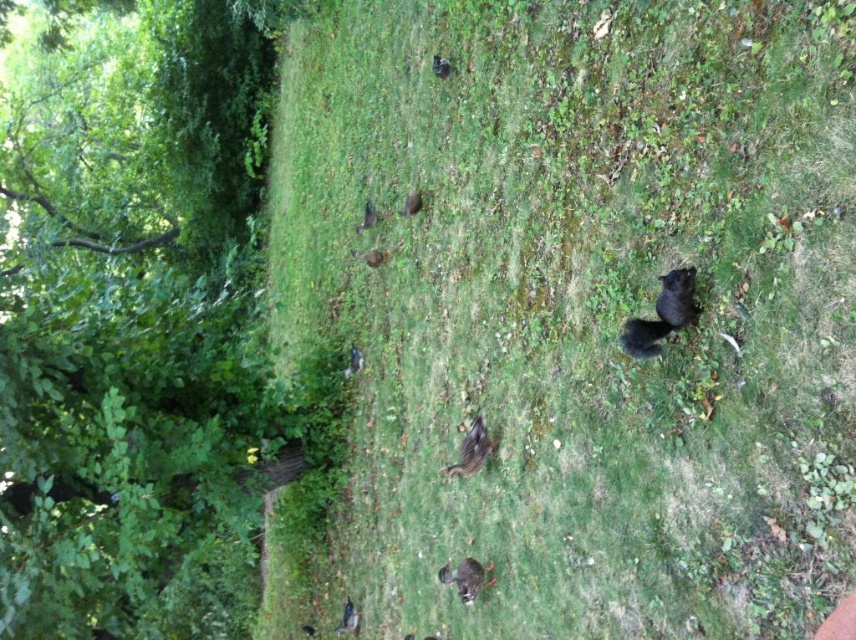
Question: Among these points, which one is nearest to the camera?

Choices:
 (A) (456, 573)
 (B) (363, 218)
 (C) (467, 445)

Answer: (A)

Question: Which of these objects is positioned closest to the fuzzy brown squirrel at center?

Choices:
 (A) shiny black duckling at lower center
 (B) black furry squirrel at center
 (C) shiny black bird at center
 (D) brown fuzzy bird at center

Answer: (D)

Question: Is brown fuzzy bird at center to the right of shiny black bird at center from the viewer's perspective?

Choices:
 (A) yes
 (B) no

Answer: (A)

Question: Which of the following is the farthest from the observer?

Choices:
 (A) brown fuzzy bird at center
 (B) shiny black squirrel at center

Answer: (A)

Question: Can you confirm if brown fuzzy bird at center is positioned below shiny black bird at center?

Choices:
 (A) no
 (B) yes

Answer: (B)

Question: Is shiny black squirrel at center bigger than brown furry squirrel at center?

Choices:
 (A) yes
 (B) no

Answer: (A)